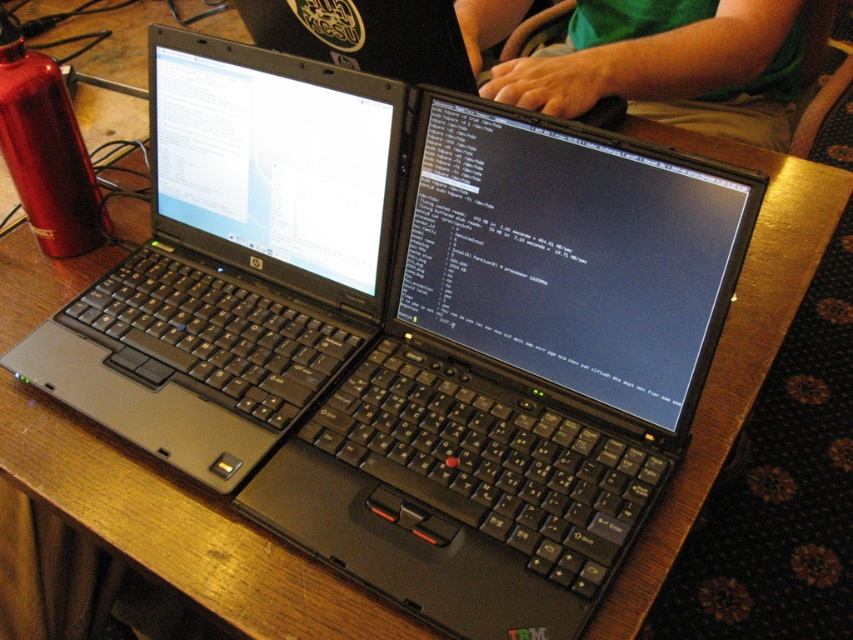
Question: Can you confirm if black plastic laptop at center is smaller than green fabric shirt at upper center?

Choices:
 (A) yes
 (B) no

Answer: (A)

Question: Among these points, which one is nearest to the camera?

Choices:
 (A) (189, 134)
 (B) (639, 1)

Answer: (A)

Question: Is black plastic laptop at center to the left of green fabric shirt at upper center from the viewer's perspective?

Choices:
 (A) yes
 (B) no

Answer: (A)

Question: Is black plastic laptop at center above green fabric shirt at upper center?

Choices:
 (A) no
 (B) yes

Answer: (A)